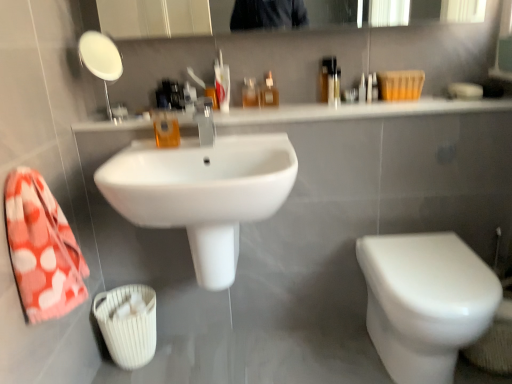
Question: Does white glossy toilet at lower right turn towards white glossy sink at upper center?

Choices:
 (A) yes
 (B) no

Answer: (B)

Question: From a real-world perspective, is white glossy toilet at lower right beneath white glossy sink at upper center?

Choices:
 (A) yes
 (B) no

Answer: (A)

Question: Is white glossy toilet at lower right smaller than white glossy sink at upper center?

Choices:
 (A) yes
 (B) no

Answer: (B)

Question: Can you confirm if white glossy toilet at lower right is taller than white glossy sink at upper center?

Choices:
 (A) no
 (B) yes

Answer: (B)

Question: Can you confirm if white glossy toilet at lower right is wider than white glossy sink at upper center?

Choices:
 (A) no
 (B) yes

Answer: (B)

Question: Considering the relative sizes of white glossy toilet at lower right and white glossy sink at upper center in the image provided, is white glossy toilet at lower right thinner than white glossy sink at upper center?

Choices:
 (A) yes
 (B) no

Answer: (B)

Question: Is white glossy toilet at lower right inside satin nickel faucet at center?

Choices:
 (A) yes
 (B) no

Answer: (B)

Question: Is satin nickel faucet at center at the left side of white glossy toilet at lower right?

Choices:
 (A) yes
 (B) no

Answer: (A)

Question: Considering the relative positions of satin nickel faucet at center and white glossy toilet at lower right in the image provided, is satin nickel faucet at center to the right of white glossy toilet at lower right from the viewer's perspective?

Choices:
 (A) no
 (B) yes

Answer: (A)

Question: Is satin nickel faucet at center aimed at white glossy toilet at lower right?

Choices:
 (A) no
 (B) yes

Answer: (A)

Question: Considering the relative sizes of satin nickel faucet at center and white glossy toilet at lower right in the image provided, is satin nickel faucet at center wider than white glossy toilet at lower right?

Choices:
 (A) no
 (B) yes

Answer: (A)

Question: From a real-world perspective, does satin nickel faucet at center stand above white glossy toilet at lower right?

Choices:
 (A) yes
 (B) no

Answer: (A)

Question: Is white glossy sink at upper center to the right of translucent plastic bottle at upper center, which is the 2th mouthwash in front-to-back order, from the viewer's perspective?

Choices:
 (A) yes
 (B) no

Answer: (A)